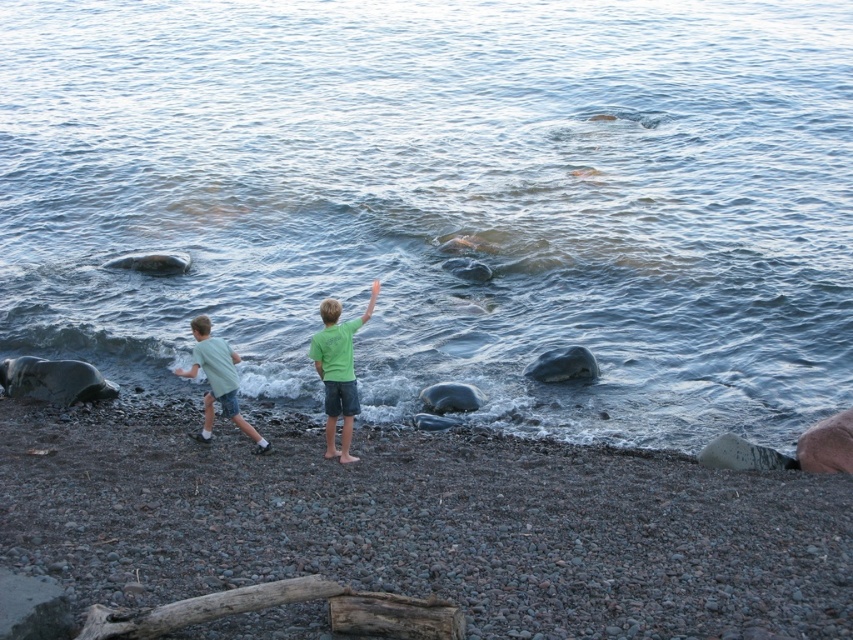
You are a photographer trying to capture both children in a single frame. Given that the green matte shirt at center and the light green cotton shirt at left are in the scene, which child should you focus on to ensure both are visible without zooming in?

The light green cotton shirt at left occupies more space in the frame than the green matte shirt at center, so focusing on the light green cotton shirt at left would allow both children to be visible without zooming in.